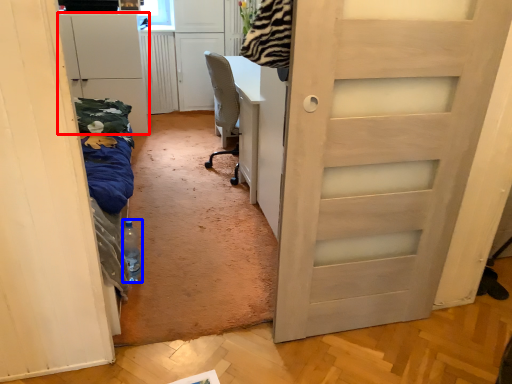
Question: Which object is closer to the camera taking this photo, cabinetry (highlighted by a red box) or bottle (highlighted by a blue box)?

Choices:
 (A) cabinetry
 (B) bottle

Answer: (B)